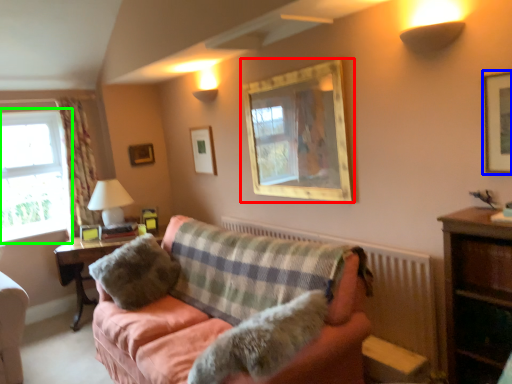
Question: Estimate the real-world distances between objects in this image. Which object is farther from picture frame (highlighted by a red box), picture frame (highlighted by a blue box) or window (highlighted by a green box)?

Choices:
 (A) picture frame
 (B) window

Answer: (B)